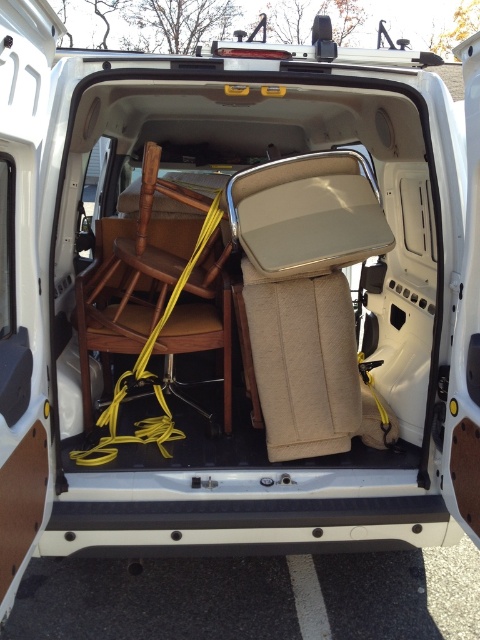
You are loading items into the back of a white van and need to know which item is closer to the entrance. Based on the image, which one is closer to you between the beige fabric folding chair at center and the wooden chair at center?

The beige fabric folding chair at center is closer to the viewer than the wooden chair at center, so it is closer to the entrance.

You are a delivery driver who needs to load an additional package that measures 18 inches in length. You have space between the beige fabric folding chair at center and the wooden chair at center. Can the package fit in that space?

The distance between the beige fabric folding chair at center and the wooden chair at center is 22.77 inches. Since the package is 18 inches long, it can fit in the space between them.